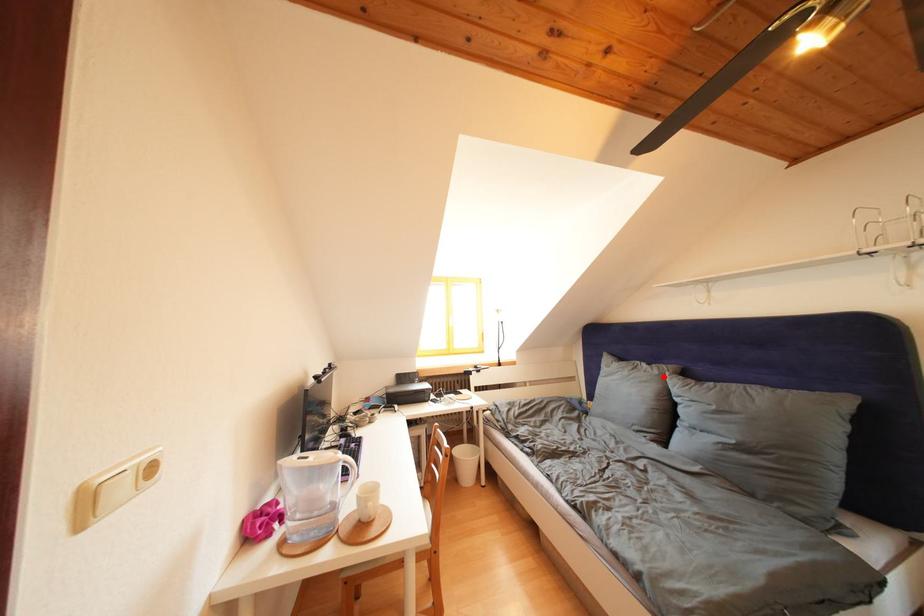
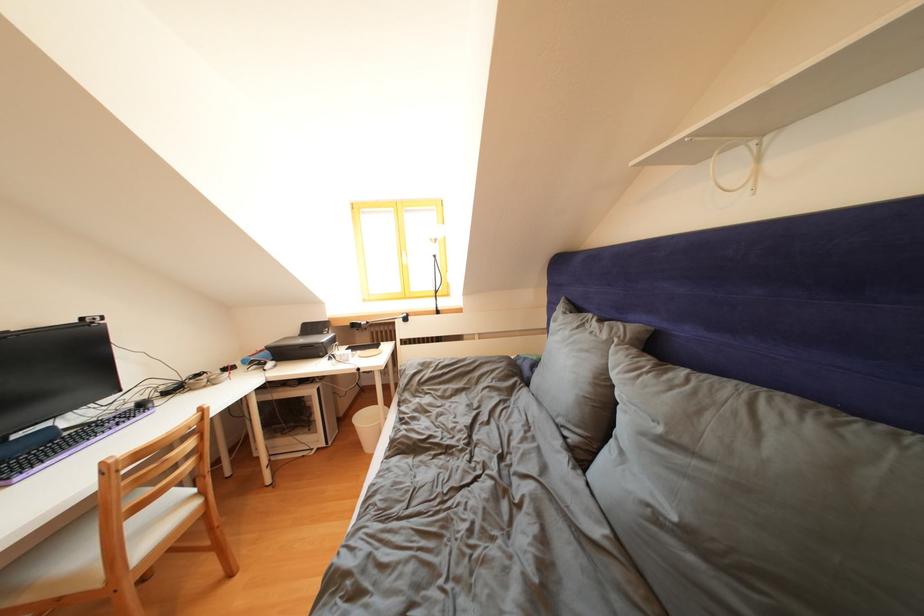
Where in the second image is the point corresponding to the highlighted location from the first image?

(612, 341)